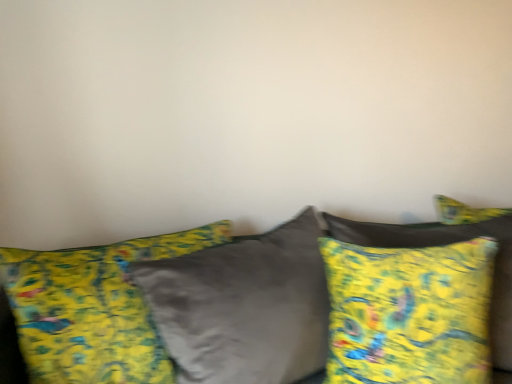
Question: Is velvet yellow pillows at center oriented away from yellow fabric pillow at right, the first pillow positioned from the right?

Choices:
 (A) no
 (B) yes

Answer: (B)

Question: Can you confirm if velvet yellow pillows at center is wider than yellow fabric pillow at right, the first pillow positioned from the right?

Choices:
 (A) yes
 (B) no

Answer: (A)

Question: Is velvet yellow pillows at center surrounding yellow fabric pillow at right, the second pillow from the left?

Choices:
 (A) no
 (B) yes

Answer: (B)

Question: Considering the relative sizes of velvet yellow pillows at center and yellow fabric pillow at right, the first pillow positioned from the right, in the image provided, is velvet yellow pillows at center shorter than yellow fabric pillow at right, the first pillow positioned from the right,?

Choices:
 (A) yes
 (B) no

Answer: (B)

Question: From the image's perspective, is velvet yellow pillows at center under yellow fabric pillow at right, the first pillow positioned from the right?

Choices:
 (A) yes
 (B) no

Answer: (A)

Question: Can you confirm if velvet yellow pillows at center is positioned to the left of yellow fabric pillow at right, the second pillow from the left?

Choices:
 (A) yes
 (B) no

Answer: (A)

Question: Would you consider yellow fabric pillow at center, the 1th pillow in the left-to-right sequence, to be distant from velvet yellow pillows at center?

Choices:
 (A) no
 (B) yes

Answer: (A)

Question: Does yellow fabric pillow at center, acting as the second pillow starting from the right, lie in front of velvet yellow pillows at center?

Choices:
 (A) yes
 (B) no

Answer: (B)

Question: Does yellow fabric pillow at center, the 1th pillow in the left-to-right sequence, appear on the left side of velvet yellow pillows at center?

Choices:
 (A) yes
 (B) no

Answer: (A)

Question: Is the position of yellow fabric pillow at center, acting as the second pillow starting from the right, more distant than that of velvet yellow pillows at center?

Choices:
 (A) no
 (B) yes

Answer: (B)

Question: Is yellow fabric pillow at center, the 1th pillow in the left-to-right sequence, smaller than velvet yellow pillows at center?

Choices:
 (A) no
 (B) yes

Answer: (B)

Question: Is yellow fabric pillow at center, acting as the second pillow starting from the right, oriented towards velvet yellow pillows at center?

Choices:
 (A) no
 (B) yes

Answer: (B)

Question: From the image's perspective, is yellow fabric pillow at center, acting as the second pillow starting from the right, under yellow fabric pillow at right, the first pillow positioned from the right?

Choices:
 (A) yes
 (B) no

Answer: (A)